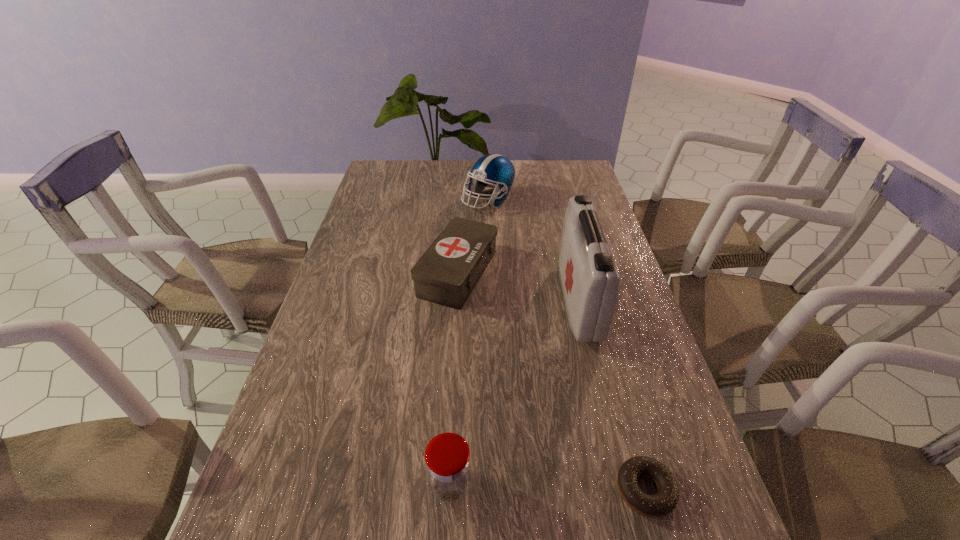
At what (x,y) coordinates should I click in order to perform the action: click on vacant space at the right edge of the desktop. Please return your answer as a coordinate pair (x, y). Image resolution: width=960 pixels, height=540 pixels. Looking at the image, I should click on (597, 197).

Identify the location of vacant region at the far left corner of the desktop. The image size is (960, 540). (407, 168).

Identify the location of empty location between the jar and the shorter first-aid kit. The image size is (960, 540). (454, 379).

This screenshot has height=540, width=960. Find the location of `free area in between the tallest object and the jar`. free area in between the tallest object and the jar is located at coordinates (515, 393).

Locate an element on the screen. This screenshot has height=540, width=960. unoccupied area between the second shortest object and the doughnut is located at coordinates (551, 381).

I want to click on vacant area that lies between the taller first-aid kit and the left first-aid kit, so click(x=518, y=287).

Find the location of `free point between the left first-aid kit and the third shortest object`. free point between the left first-aid kit and the third shortest object is located at coordinates (454, 379).

Where is `free space between the shortest object and the farthest object`? The height and width of the screenshot is (540, 960). free space between the shortest object and the farthest object is located at coordinates (566, 345).

I want to click on free space between the shortest object and the taller first-aid kit, so click(x=612, y=396).

Where is `free point between the football helmet and the shortest object`? free point between the football helmet and the shortest object is located at coordinates (566, 345).